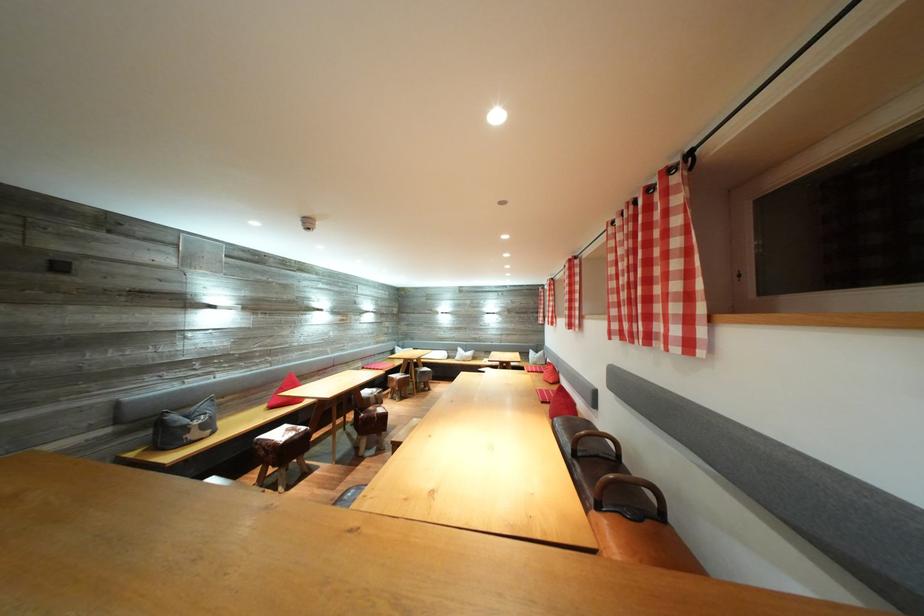
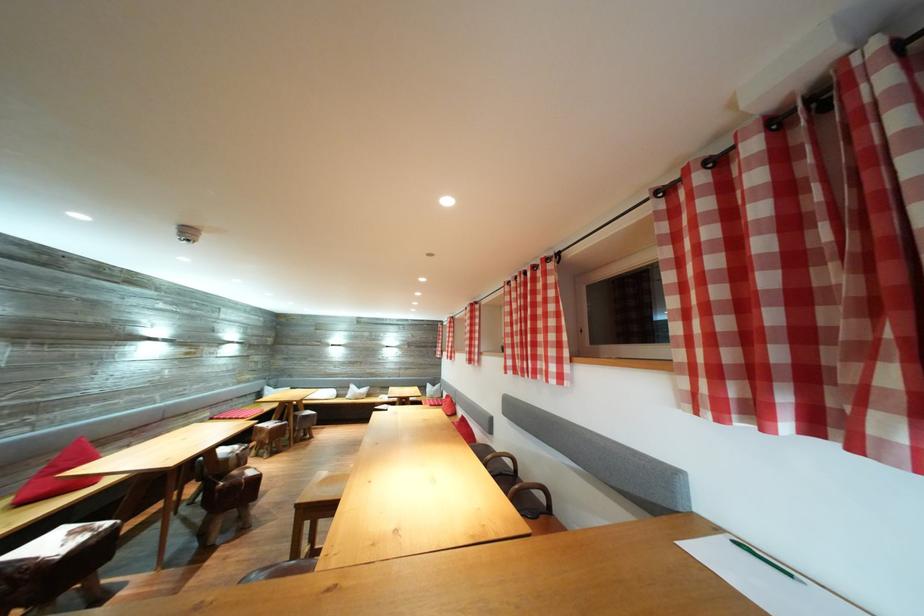
The point at (481, 363) is marked in the first image. Where is the corresponding point in the second image?

(375, 400)